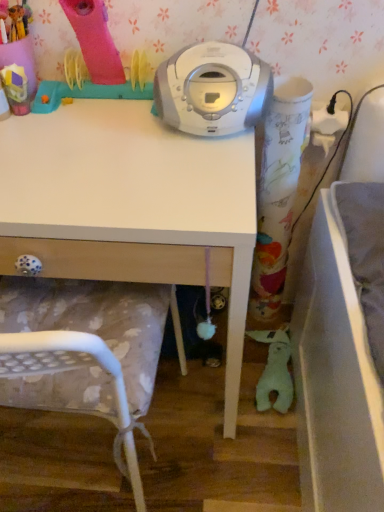
Where is `free location in front of white plastic cd player at center`? This screenshot has height=512, width=384. free location in front of white plastic cd player at center is located at coordinates (186, 178).